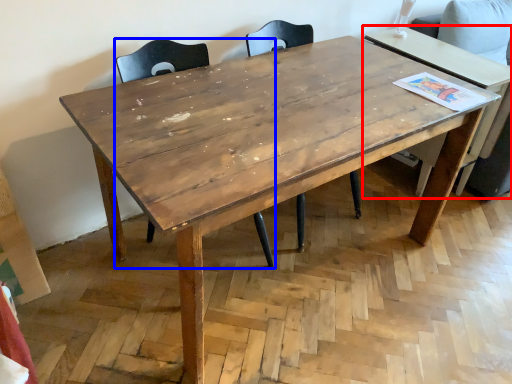
Question: Which object is closer to the camera taking this photo, table (highlighted by a red box) or chair (highlighted by a blue box)?

Choices:
 (A) table
 (B) chair

Answer: (B)